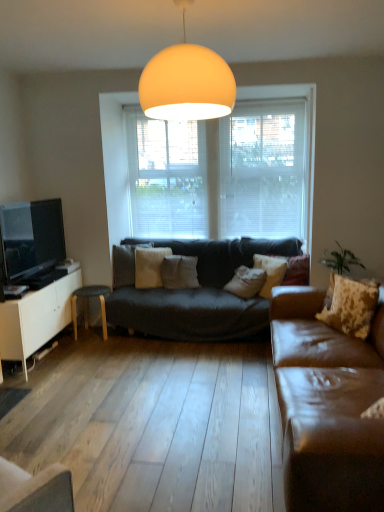
Question: Is the surface of white cotton pillow at center, which is the first pillow in back-to-front order, in direct contact with white matte cabinet at left?

Choices:
 (A) yes
 (B) no

Answer: (B)

Question: Can you confirm if white cotton pillow at center, placed as the 4th pillow when sorted from front to back, is smaller than white matte cabinet at left?

Choices:
 (A) yes
 (B) no

Answer: (A)

Question: Considering the relative sizes of white cotton pillow at center, arranged as the second pillow when viewed from the left, and white matte cabinet at left in the image provided, is white cotton pillow at center, arranged as the second pillow when viewed from the left, taller than white matte cabinet at left?

Choices:
 (A) no
 (B) yes

Answer: (A)

Question: Does white cotton pillow at center, arranged as the second pillow when viewed from the left, appear on the right side of white matte cabinet at left?

Choices:
 (A) no
 (B) yes

Answer: (B)

Question: Does white cotton pillow at center, placed as the 4th pillow when sorted from front to back, have a larger size compared to white matte cabinet at left?

Choices:
 (A) no
 (B) yes

Answer: (A)

Question: Considering the relative positions of wooden stool at left and matte orange globe at upper center in the image provided, is wooden stool at left to the left or to the right of matte orange globe at upper center?

Choices:
 (A) left
 (B) right

Answer: (A)

Question: Does point (74, 291) appear closer or farther from the camera than point (178, 86)?

Choices:
 (A) farther
 (B) closer

Answer: (A)

Question: In terms of height, does wooden stool at left look taller or shorter compared to matte orange globe at upper center?

Choices:
 (A) short
 (B) tall

Answer: (A)

Question: Is wooden stool at left inside the boundaries of matte orange globe at upper center, or outside?

Choices:
 (A) outside
 (B) inside

Answer: (A)

Question: From the image's perspective, is fluffy beige pillow at right, the 1th pillow viewed from the front, located above or below matte black tv at left?

Choices:
 (A) above
 (B) below

Answer: (B)

Question: Is fluffy beige pillow at right, which appears as the fourth pillow when viewed from the left, inside or outside of matte black tv at left?

Choices:
 (A) outside
 (B) inside

Answer: (A)

Question: Is fluffy beige pillow at right, which ranks as the 4th pillow in back-to-front order, bigger or smaller than matte black tv at left?

Choices:
 (A) big
 (B) small

Answer: (B)

Question: In the image, is fluffy beige pillow at right, the 1th pillow viewed from the front, positioned in front of or behind matte black tv at left?

Choices:
 (A) behind
 (B) front

Answer: (B)

Question: Considering their positions, is white cotton pillow at center, arranged as the second pillow when viewed from the left, located in front of or behind white sheer blinds at center?

Choices:
 (A) behind
 (B) front

Answer: (B)

Question: In the image, is white cotton pillow at center, which is the first pillow in back-to-front order, on the left side or the right side of white sheer blinds at center?

Choices:
 (A) left
 (B) right

Answer: (A)